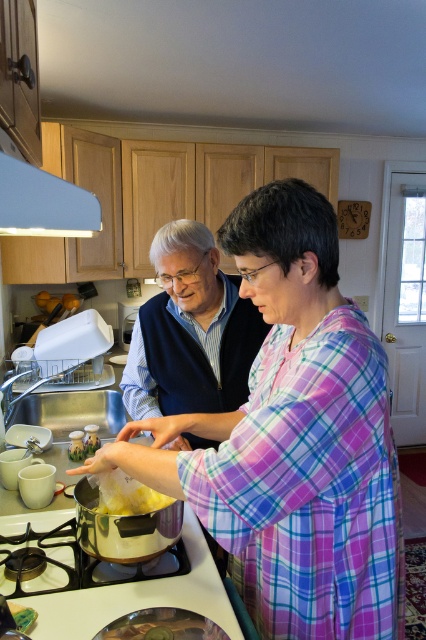
In the kitchen scene, there are two people and a point marked at coordinates (138, 596). The point corresponds to an object. Which object is located at that coordinate?

The point at coordinates (138, 596) marks the stainless steel pot at lower center.